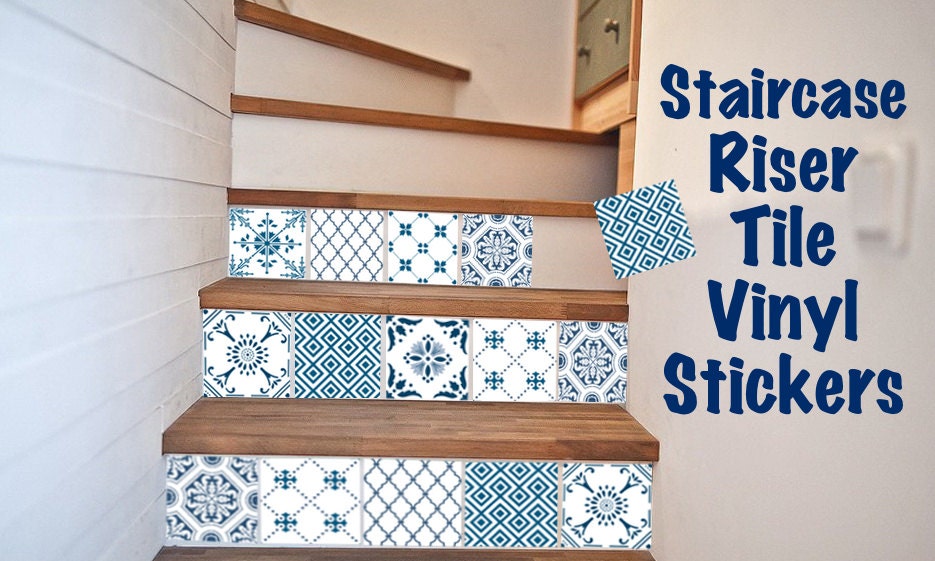
In order to click on drawer handle in this screenshot , I will do `click(609, 24)`, `click(579, 50)`.